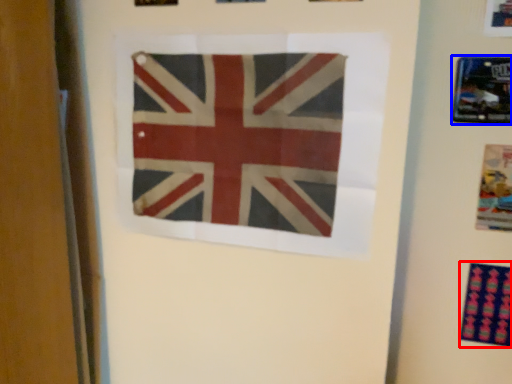
Question: Among these objects, which one is farthest to the camera, print (highlighted by a red box) or picture frame (highlighted by a blue box)?

Choices:
 (A) print
 (B) picture frame

Answer: (A)